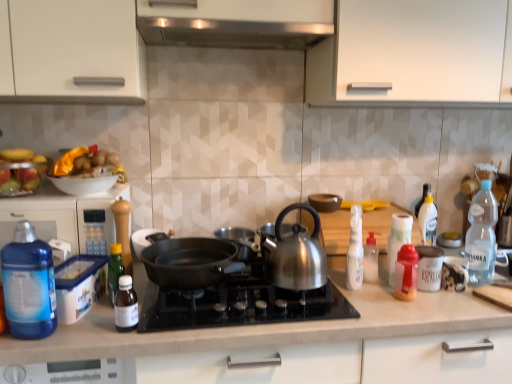
Locate an element on the screen. The height and width of the screenshot is (384, 512). free space between translucent plastic bottle at lower left, the third bottle viewed from the left, and blue translucent bottle at left, marked as the 1th bottle in a left-to-right arrangement is located at coordinates (94, 329).